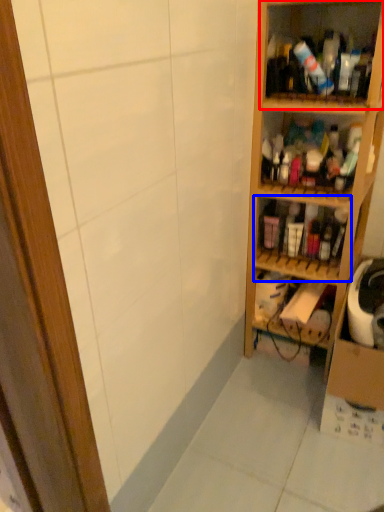
Question: Among these objects, which one is farthest to the camera, shelf (highlighted by a red box) or shelf (highlighted by a blue box)?

Choices:
 (A) shelf
 (B) shelf

Answer: (B)